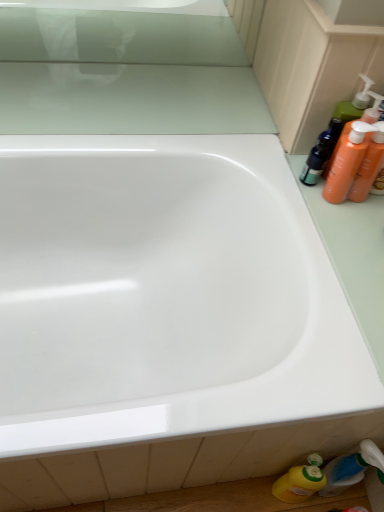
Identify the location of vacant area that lies in front of orange plastic bottles at upper right, the 1th toiletry from the top. The height and width of the screenshot is (512, 384). (333, 218).